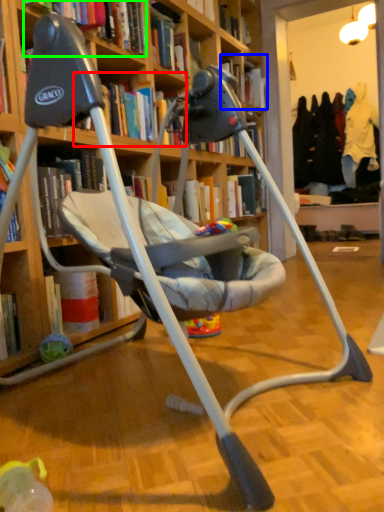
Question: Estimate the real-world distances between objects in this image. Which object is closer to book (highlighted by a red box), book (highlighted by a blue box) or book (highlighted by a green box)?

Choices:
 (A) book
 (B) book

Answer: (B)